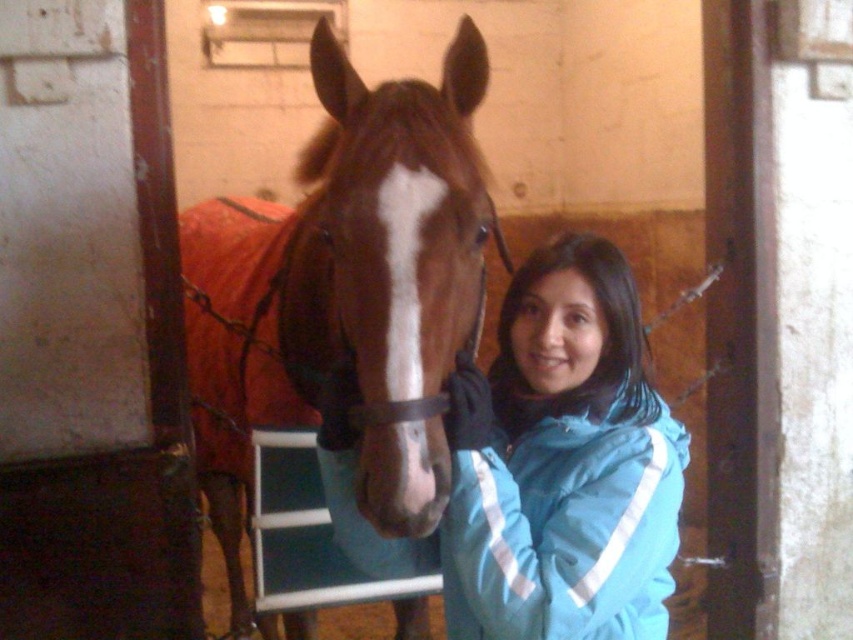
You are a photographer with a camera that requires a minimum distance of 1.2 meters to focus properly. You are currently positioned at the camera location in the image. Can you focus on the brown glossy horse at center with your current setup?

The distance between the brown glossy horse at center and the camera is 1.19 meters, which is slightly less than the required 1.2 meters. Therefore, the camera might not focus properly on the brown glossy horse at center.

You are a visitor at the stable and want to feed the brown glossy horse at center with a carrot. The carrot is in your pocket, but you need to reach it without getting too close to the blue synthetic jacket at center. Can you safely do this?

The brown glossy horse at center is 14.56 inches from the blue synthetic jacket at center. Since the distance is relatively close, you should be cautious to avoid the jacket when reaching for the carrot to ensure safety.

You are standing in the stable and see the brown glossy horse at center and the blue synthetic jacket at center. Which object is positioned to the left?

The brown glossy horse at center is to the left of the blue synthetic jacket at center.